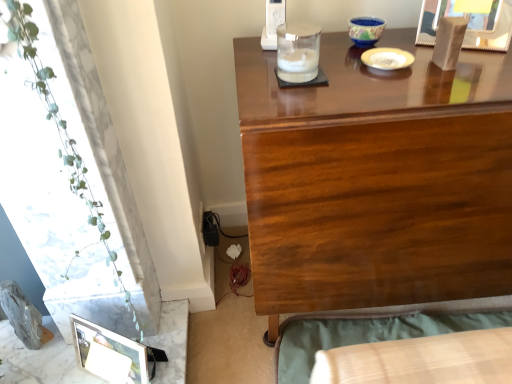
In order to click on empty space that is to the right of clear glass candle holder at upper center, which is the first candle holder in bottom-to-top order in this screenshot , I will do `click(376, 71)`.